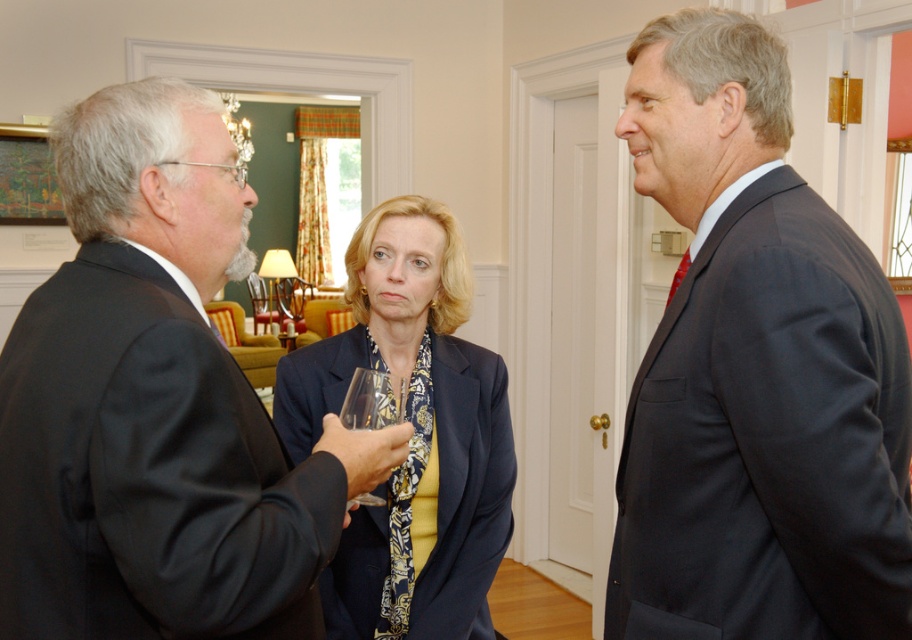
Can you confirm if black matte suit at left is positioned to the right of transparent glass at center?

Incorrect, black matte suit at left is not on the right side of transparent glass at center.

Does point (148, 298) lie behind point (354, 378)?

That is False.

The height and width of the screenshot is (640, 912). I want to click on black matte suit at left, so click(156, 404).

Can you confirm if dark blue suit at right is positioned above black matte suit at left?

Correct, dark blue suit at right is located above black matte suit at left.

Which is above, dark blue suit at right or black matte suit at left?

Positioned higher is dark blue suit at right.

Describe the element at coordinates (755, 372) in the screenshot. Image resolution: width=912 pixels, height=640 pixels. I see `dark blue suit at right` at that location.

You are a GUI agent. You are given a task and a screenshot of the screen. Output one action in this format:
    pyautogui.click(x=<x>, y=<y>)
    Task: Click on the dark blue suit at right
    The width and height of the screenshot is (912, 640).
    Given the screenshot: What is the action you would take?
    pyautogui.click(x=755, y=372)

Can you confirm if matte blue blazer at center is shorter than transparent glass at center?

Incorrect, matte blue blazer at center's height does not fall short of transparent glass at center's.

Is point (444, 307) behind point (375, 420)?

Yes.

Where is `matte blue blazer at center`? matte blue blazer at center is located at coordinates [x=413, y=435].